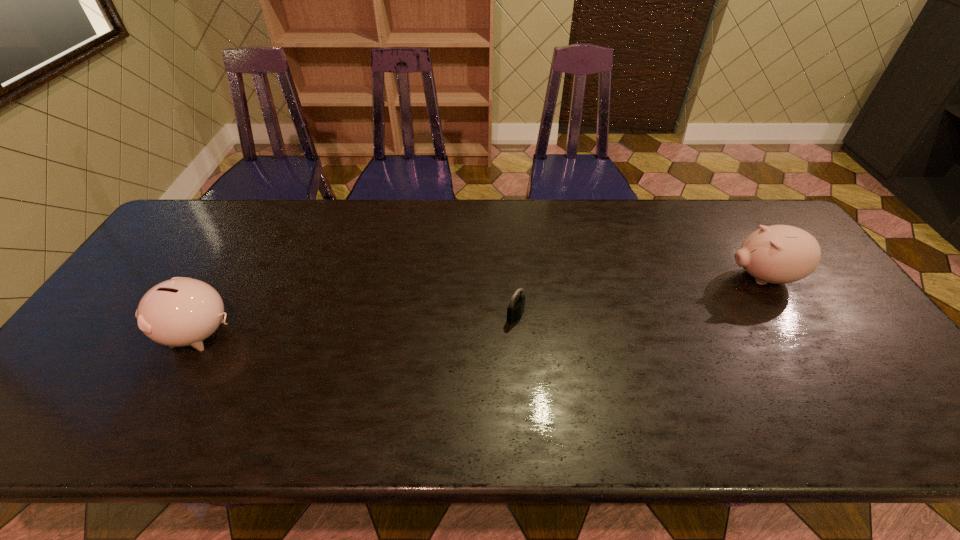
This screenshot has height=540, width=960. I want to click on the rightmost object, so pos(779,254).

Locate an element on the screen. This screenshot has width=960, height=540. the farthest object is located at coordinates (779, 254).

In order to click on the left piggy bank in this screenshot , I will do pos(182,311).

This screenshot has width=960, height=540. In order to click on the leftmost object in this screenshot , I will do `click(182, 311)`.

Find the location of a particular element. This screenshot has width=960, height=540. padlock is located at coordinates (516, 307).

Where is `the second object from left to right`? The image size is (960, 540). the second object from left to right is located at coordinates (516, 307).

Find the location of a particular element. free region located 0.050m at the snout of the farthest object is located at coordinates (708, 277).

Where is `vacant region located at the snout of the farthest object`? vacant region located at the snout of the farthest object is located at coordinates (657, 277).

Find the location of a particular element. The width and height of the screenshot is (960, 540). vacant space located at the snout of the farthest object is located at coordinates (622, 277).

Find the location of `free spot located on the back of the left piggy bank`. free spot located on the back of the left piggy bank is located at coordinates (256, 233).